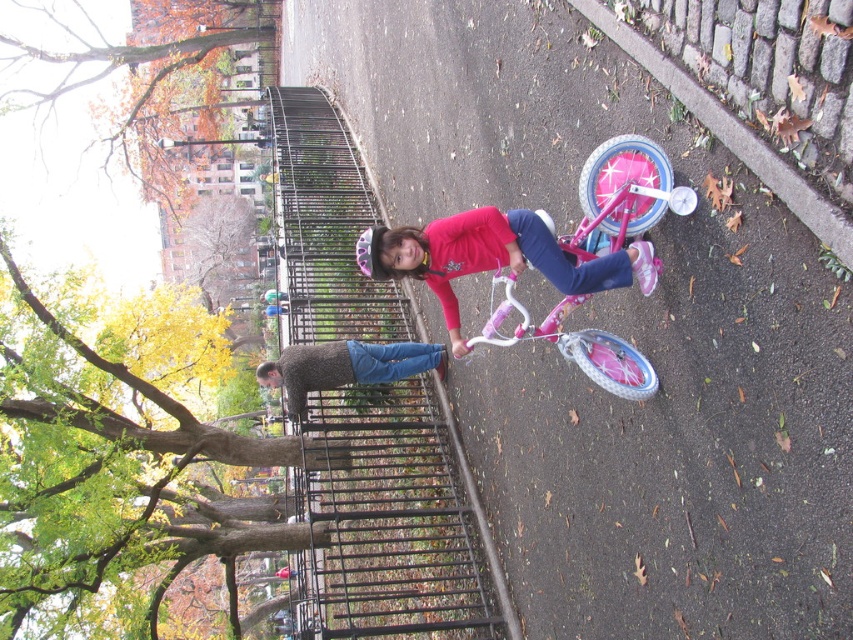
You are a parent trying to locate your child who is wearing a knitted sweater at center. You see a pink metallic bicycle at center in the park. Based on the scene, where would you find the child relative to the bicycle?

The pink metallic bicycle at center is in front of the knitted sweater at center, so the child wearing the knitted sweater at center is behind the bicycle.